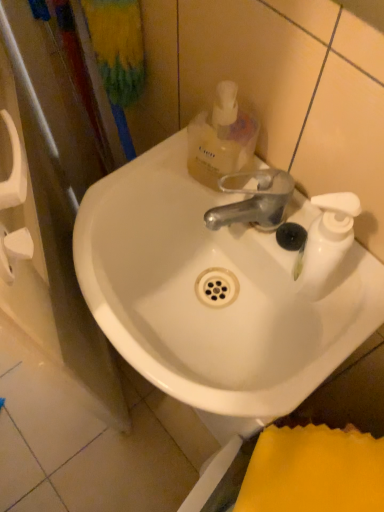
At what (x,y) coordinates should I click in order to perform the action: click on white glossy sink at center. Please return your answer as a coordinate pair (x, y). Looking at the image, I should click on (209, 305).

What do you see at coordinates (209, 305) in the screenshot? I see `white glossy sink at center` at bounding box center [209, 305].

What do you see at coordinates (221, 138) in the screenshot? This screenshot has height=512, width=384. I see `translucent plastic mouthwash at upper center` at bounding box center [221, 138].

At what (x,y) coordinates should I click in order to perform the action: click on translucent plastic mouthwash at upper center. Please return your answer as a coordinate pair (x, y). The height and width of the screenshot is (512, 384). Looking at the image, I should click on (221, 138).

What is the approximate height of translucent plastic mouthwash at upper center?

translucent plastic mouthwash at upper center is 16.52 centimeters in height.

At what (x,y) coordinates should I click in order to perform the action: click on white glossy sink at center. Please return your answer as a coordinate pair (x, y). Looking at the image, I should click on (209, 305).

In the image, is translucent plastic mouthwash at upper center on the left side or the right side of white glossy sink at center?

In the image, translucent plastic mouthwash at upper center appears on the right side of white glossy sink at center.

Which object is further away from the camera, translucent plastic mouthwash at upper center or white glossy sink at center?

translucent plastic mouthwash at upper center.

Is point (211, 183) positioned in front of point (140, 292)?

Yes, point (211, 183) is in front of point (140, 292).

From the image's perspective, does translucent plastic mouthwash at upper center appear lower than white glossy sink at center?

Incorrect, from the image's perspective, translucent plastic mouthwash at upper center is higher than white glossy sink at center.

From a real-world perspective, which is physically above, translucent plastic mouthwash at upper center or white glossy sink at center?

translucent plastic mouthwash at upper center is physically above.

Does translucent plastic mouthwash at upper center have a lesser width compared to white glossy sink at center?

Correct, the width of translucent plastic mouthwash at upper center is less than that of white glossy sink at center.

In the scene shown: Considering the relative sizes of translucent plastic mouthwash at upper center and white glossy sink at center in the image provided, is translucent plastic mouthwash at upper center taller than white glossy sink at center?

Yes, translucent plastic mouthwash at upper center is taller than white glossy sink at center.

Is translucent plastic mouthwash at upper center bigger or smaller than white glossy sink at center?

In the image, translucent plastic mouthwash at upper center appears to be smaller than white glossy sink at center.

Is translucent plastic mouthwash at upper center inside or outside of white glossy sink at center?

translucent plastic mouthwash at upper center exists outside the volume of white glossy sink at center.

Is translucent plastic mouthwash at upper center directly adjacent to white glossy sink at center?

No, translucent plastic mouthwash at upper center is not with white glossy sink at center.

Is translucent plastic mouthwash at upper center aimed at white glossy sink at center?

No, translucent plastic mouthwash at upper center is not facing towards white glossy sink at center.

What's the angular difference between translucent plastic mouthwash at upper center and white glossy sink at center's facing directions?

The angular difference between translucent plastic mouthwash at upper center and white glossy sink at center is 0.00259 degrees.

I want to click on sink that appears on the left of translucent plastic mouthwash at upper center, so click(209, 305).

Based on the photo, is white glossy sink at center at the right side of translucent plastic mouthwash at upper center?

No.

Who is more distant, white glossy sink at center or translucent plastic mouthwash at upper center?

translucent plastic mouthwash at upper center is further away from the camera.

Which is closer to the camera, [148,236] or [194,141]?

Point [148,236] is farther from the camera than point [194,141].

From the image's perspective, between white glossy sink at center and translucent plastic mouthwash at upper center, which one is located above?

From the image's view, translucent plastic mouthwash at upper center is above.

From a real-world perspective, between white glossy sink at center and translucent plastic mouthwash at upper center, who is vertically higher?

translucent plastic mouthwash at upper center, from a real-world perspective.

Does white glossy sink at center have a lesser width compared to translucent plastic mouthwash at upper center?

In fact, white glossy sink at center might be wider than translucent plastic mouthwash at upper center.

Between white glossy sink at center and translucent plastic mouthwash at upper center, which one has more height?

translucent plastic mouthwash at upper center.

Is white glossy sink at center smaller than translucent plastic mouthwash at upper center?

No.

Could translucent plastic mouthwash at upper center be considered to be inside white glossy sink at center?

No, translucent plastic mouthwash at upper center is not surrounded by white glossy sink at center.

Is white glossy sink at center far from translucent plastic mouthwash at upper center?

Actually, white glossy sink at center and translucent plastic mouthwash at upper center are a little close together.

Could you tell me if white glossy sink at center is facing translucent plastic mouthwash at upper center?

No, white glossy sink at center does not turn towards translucent plastic mouthwash at upper center.

Measure the distance from white glossy sink at center to translucent plastic mouthwash at upper center.

white glossy sink at center is 6.52 inches away from translucent plastic mouthwash at upper center.

This screenshot has height=512, width=384. In order to click on mouthwash on the right of the white glossy sink at center in this screenshot , I will do `click(221, 138)`.

In order to click on sink in front of the translucent plastic mouthwash at upper center in this screenshot , I will do pyautogui.click(x=209, y=305).

This screenshot has height=512, width=384. What are the coordinates of `mouthwash that appears above the white glossy sink at center (from the image's perspective)` in the screenshot? It's located at (221, 138).